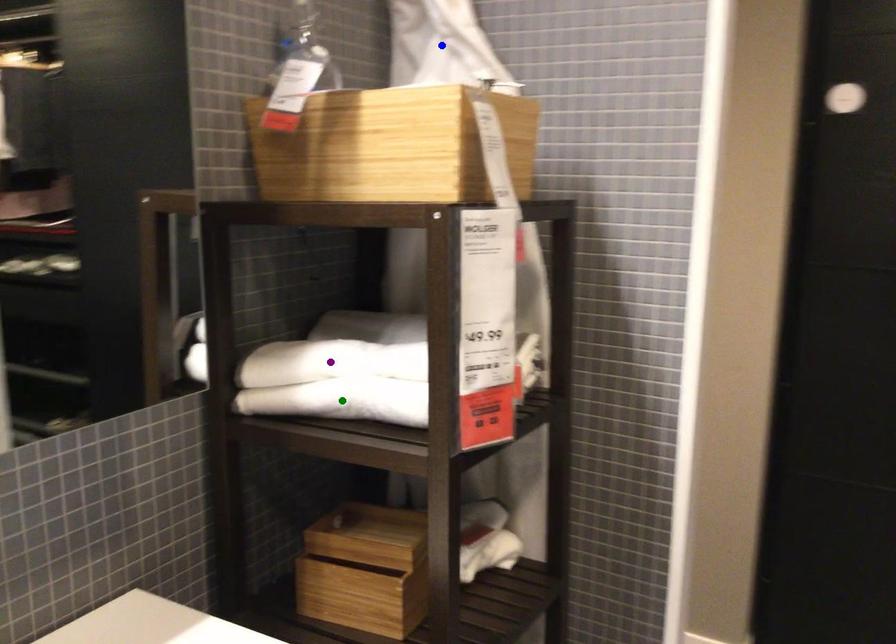
Order these from nearest to farthest:
- blue point
- purple point
- green point

1. green point
2. purple point
3. blue point